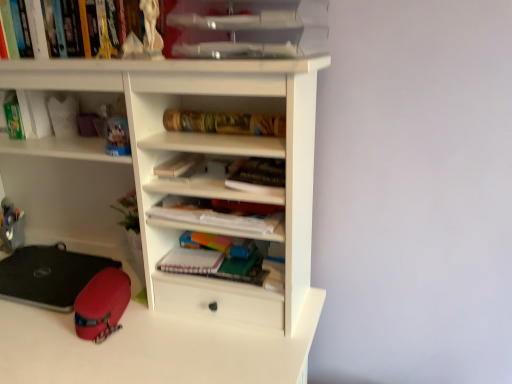
Question: Is white matte paper at center, the 1th paperback book when ordered from top to bottom, closer to camera compared to clear plastic trays at upper center?

Choices:
 (A) no
 (B) yes

Answer: (A)

Question: Does white matte paper at center, the 1th paperback book when ordered from top to bottom, have a greater width compared to clear plastic trays at upper center?

Choices:
 (A) no
 (B) yes

Answer: (A)

Question: Is white matte paper at center, which appears as the second paperback book when ordered from the bottom, taller than clear plastic trays at upper center?

Choices:
 (A) yes
 (B) no

Answer: (B)

Question: From a real-world perspective, is white matte paper at center, the 1th paperback book when ordered from top to bottom, over clear plastic trays at upper center?

Choices:
 (A) yes
 (B) no

Answer: (B)

Question: Are white matte paper at center, the 1th paperback book when ordered from top to bottom, and clear plastic trays at upper center far apart?

Choices:
 (A) yes
 (B) no

Answer: (B)

Question: From a real-world perspective, is rubberized red case at lower left above or below white matte notebook at center, which ranks as the 1th paperback book in bottom-to-top order?

Choices:
 (A) below
 (B) above

Answer: (A)

Question: Which is correct: rubberized red case at lower left is inside white matte notebook at center, which ranks as the second paperback book in top-to-bottom order, or outside of it?

Choices:
 (A) outside
 (B) inside

Answer: (A)

Question: Considering the positions of rubberized red case at lower left and white matte notebook at center, which ranks as the second paperback book in top-to-bottom order, in the image, is rubberized red case at lower left bigger or smaller than white matte notebook at center, which ranks as the second paperback book in top-to-bottom order,?

Choices:
 (A) small
 (B) big

Answer: (B)

Question: Considering the positions of point (91, 319) and point (208, 251), is point (91, 319) closer or farther from the camera than point (208, 251)?

Choices:
 (A) closer
 (B) farther

Answer: (A)

Question: From a real-world perspective, is white plastic folder at center, arranged as the 1th book when ordered from the bottom, above or below white matte notebook at center, which ranks as the second paperback book in top-to-bottom order?

Choices:
 (A) above
 (B) below

Answer: (A)

Question: Would you say white plastic folder at center, arranged as the 1th book when ordered from the bottom, is to the left or to the right of white matte notebook at center, which ranks as the second paperback book in top-to-bottom order, in the picture?

Choices:
 (A) right
 (B) left

Answer: (A)

Question: Is white plastic folder at center, arranged as the 1th book when ordered from the bottom, in front of or behind white matte notebook at center, which ranks as the 1th paperback book in bottom-to-top order, in the image?

Choices:
 (A) front
 (B) behind

Answer: (A)

Question: From their relative heights in the image, would you say white plastic folder at center, arranged as the 1th book when ordered from the bottom, is taller or shorter than white matte notebook at center, which ranks as the second paperback book in top-to-bottom order?

Choices:
 (A) tall
 (B) short

Answer: (A)

Question: Considering the positions of point (208, 268) and point (234, 39), is point (208, 268) closer or farther from the camera than point (234, 39)?

Choices:
 (A) closer
 (B) farther

Answer: (B)

Question: From a real-world perspective, is white matte notebook at center, which ranks as the 1th paperback book in bottom-to-top order, physically located above or below clear plastic trays at upper center?

Choices:
 (A) below
 (B) above

Answer: (A)